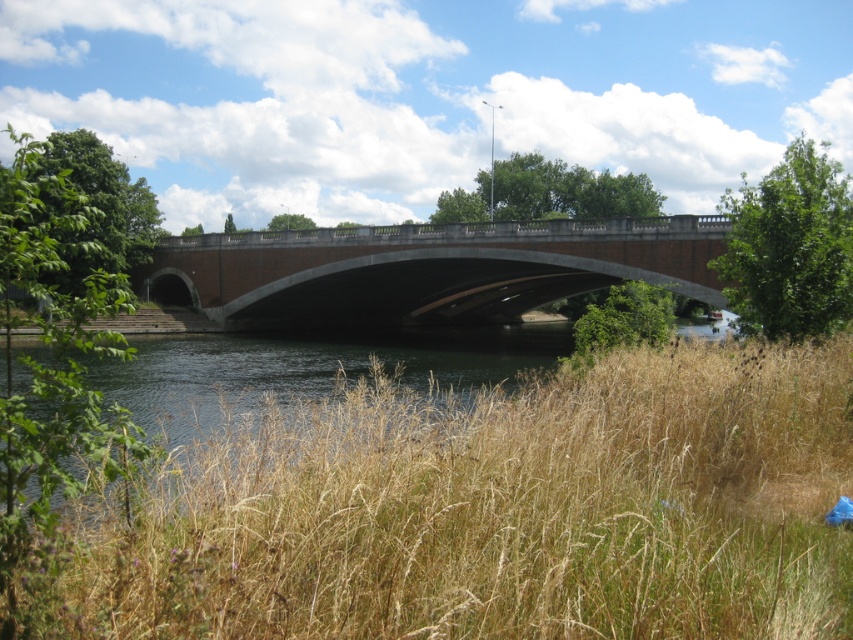
You are standing at the brick bridge and want to take a photo of both point (399, 460) and point (488, 262). Which point will appear larger in the photo?

Point (399, 460) will appear larger in the photo because it is closer to the camera than point (488, 262).

You are standing at the riverside and want to take a photo of the dry grass at lower center and the brick stone bridge at center. Which object should you focus on first if you want to capture both in a single frame without moving the camera?

The dry grass at lower center is smaller than the brick stone bridge at center, so you should focus on the brick stone bridge at center first to ensure it is in clear view before adjusting for the smaller dry grass at lower center.